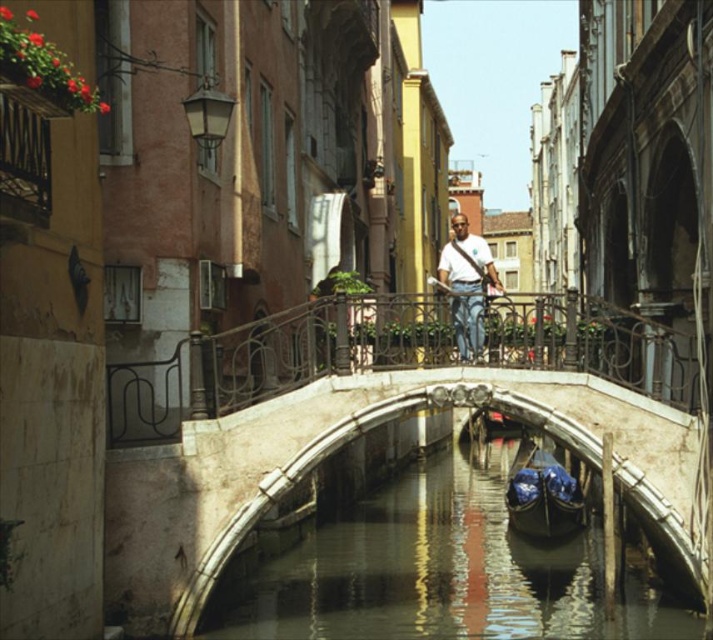
Question: Estimate the real-world distances between objects in this image. Which object is closer to the metallic iron bridge at center?

Choices:
 (A) black polished wood boat at center
 (B) white fabric shirt at center
 (C) white stone bridge at center

Answer: (C)

Question: Does white stone bridge at center have a smaller size compared to black polished wood boat at center?

Choices:
 (A) yes
 (B) no

Answer: (B)

Question: Is black polished wood boat at center thinner than white fabric shirt at center?

Choices:
 (A) yes
 (B) no

Answer: (B)

Question: Estimate the real-world distances between objects in this image. Which object is farther from the black polished wood boat at center?

Choices:
 (A) white stone bridge at center
 (B) white fabric shirt at center

Answer: (A)

Question: Is white stone bridge at center thinner than black polished wood boat at center?

Choices:
 (A) no
 (B) yes

Answer: (A)

Question: Which object appears farthest from the camera in this image?

Choices:
 (A) white stone bridge at center
 (B) black polished wood boat at center
 (C) metallic iron bridge at center

Answer: (B)